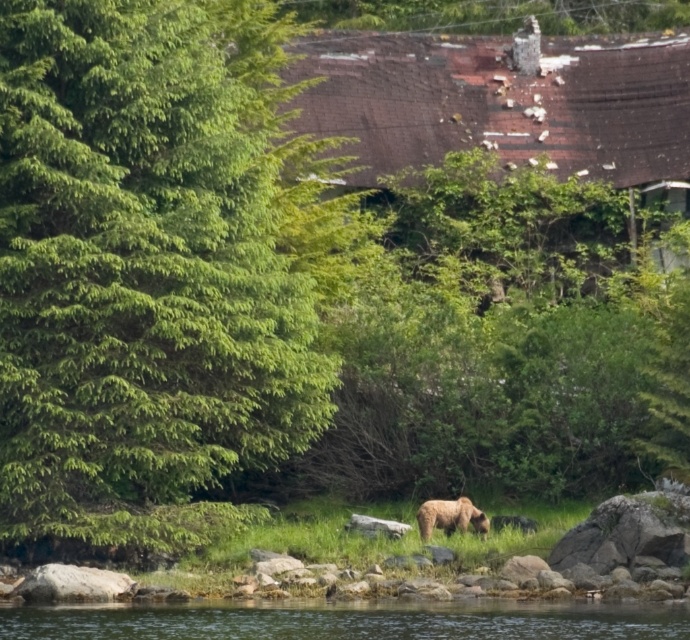
Which of these two, green leafy tree at center or clear water at lower center, stands shorter?

Standing shorter between the two is clear water at lower center.

Between point (106, 180) and point (687, 605), which one is positioned behind?

The point (106, 180) is more distant.

The image size is (690, 640). I want to click on green leafy tree at center, so click(157, 266).

Who is shorter, brown shingles at upper center or fuzzy brown bear at lower center?

With less height is fuzzy brown bear at lower center.

Looking at this image, is brown shingles at upper center wider than fuzzy brown bear at lower center?

Correct, the width of brown shingles at upper center exceeds that of fuzzy brown bear at lower center.

You are a GUI agent. You are given a task and a screenshot of the screen. Output one action in this format:
    pyautogui.click(x=<x>, y=<y>)
    Task: Click on the brown shingles at upper center
    The width and height of the screenshot is (690, 640).
    Given the screenshot: What is the action you would take?
    pyautogui.click(x=504, y=104)

The width and height of the screenshot is (690, 640). Find the location of `brown shingles at upper center`. brown shingles at upper center is located at coordinates (504, 104).

Between point (52, 317) and point (364, 40), which one is positioned in front?

Point (52, 317)

Who is more distant from viewer, (273, 296) or (620, 49)?

Positioned behind is point (620, 49).

You are a GUI agent. You are given a task and a screenshot of the screen. Output one action in this format:
    pyautogui.click(x=<x>, y=<y>)
    Task: Click on the green leafy tree at center
    Image resolution: width=690 pixels, height=640 pixels.
    Given the screenshot: What is the action you would take?
    pyautogui.click(x=157, y=266)